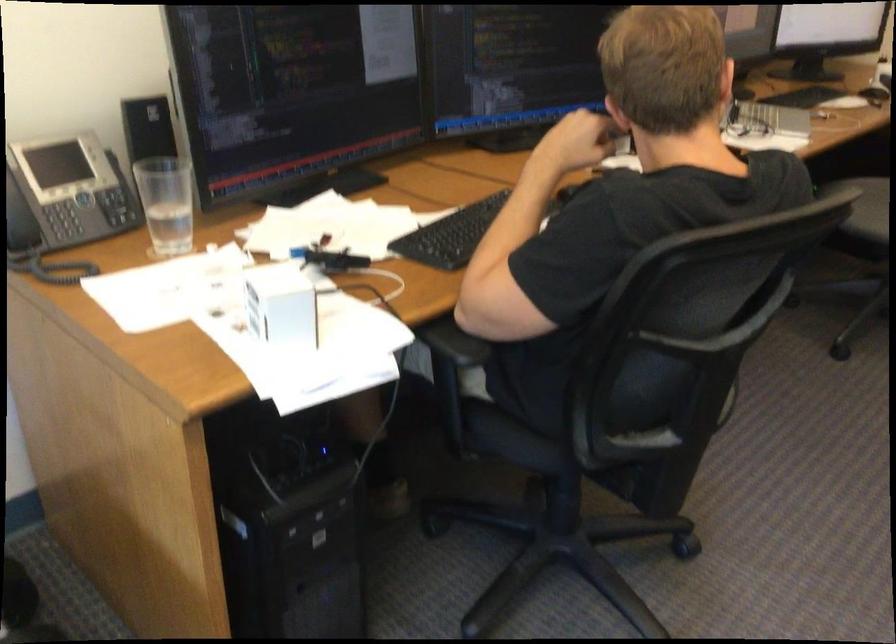
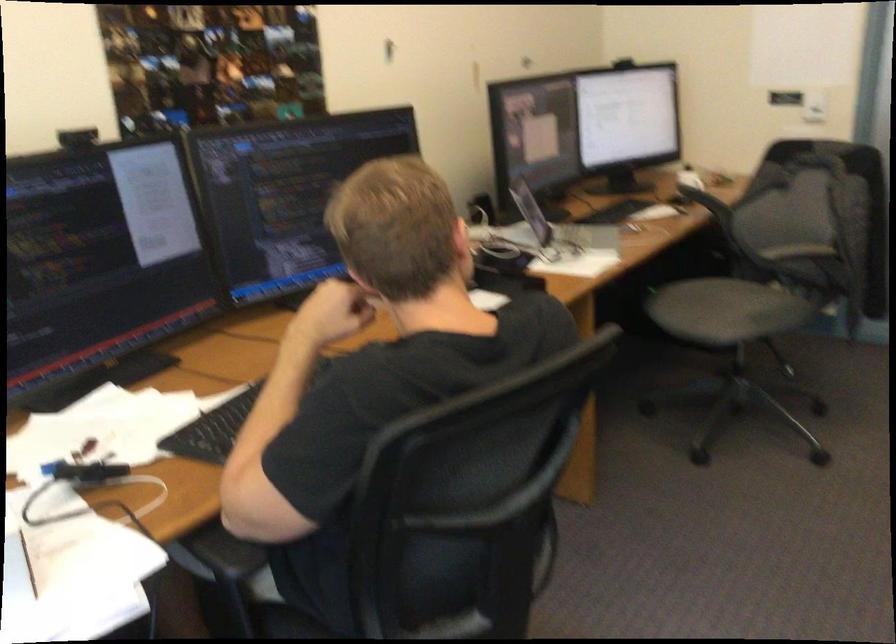
Question: Which direction would the cameraman need to move to produce the second image? Reply with the corresponding letter.

Choices:
 (A) Left
 (B) Right
 (C) Forward
 (D) Backward

Answer: (B)